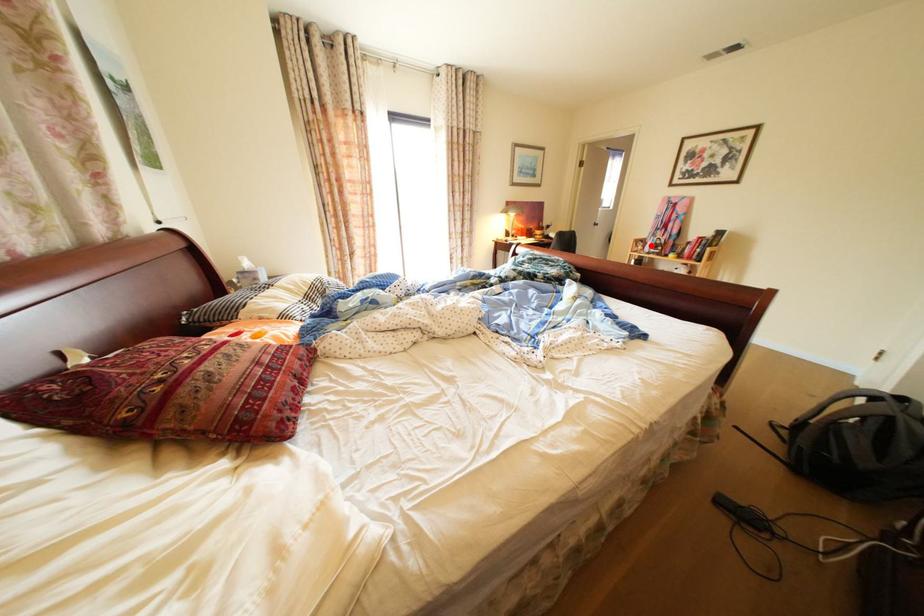
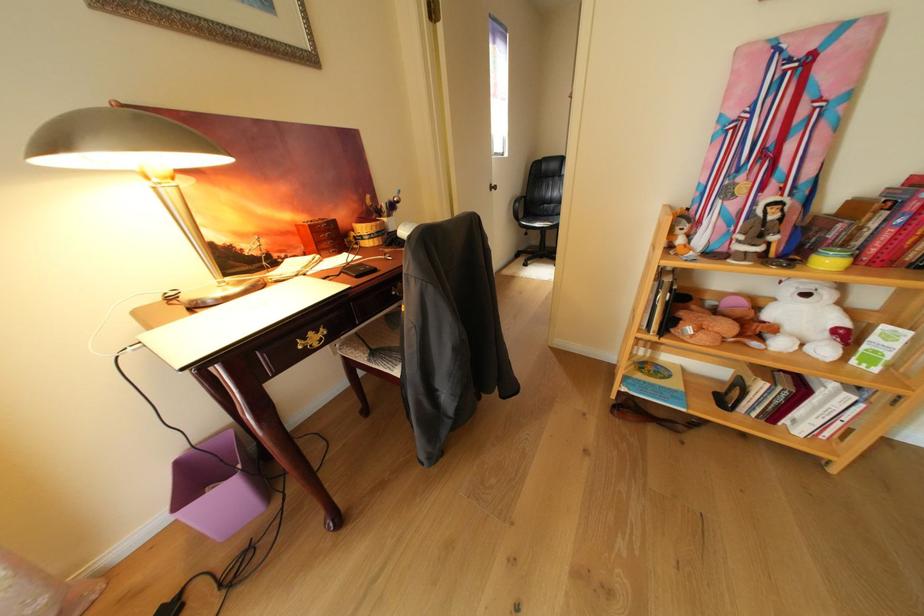
The point at the highlighted location is marked in the first image. Where is the corresponding point in the second image?

(689, 230)